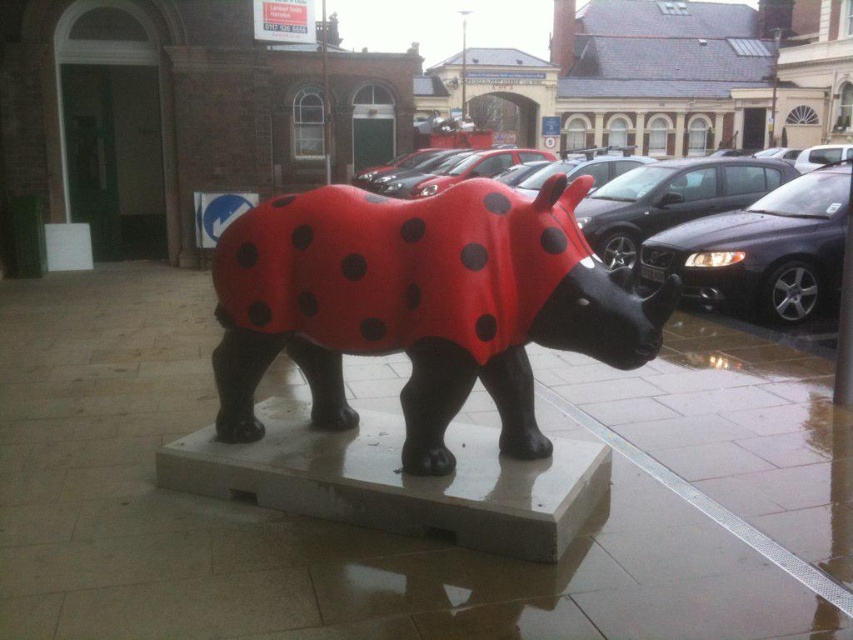
Question: Which point is closer to the camera?

Choices:
 (A) (695, 273)
 (B) (331, 294)

Answer: (B)

Question: Is matte red rhino at center wider than matte black car at right?

Choices:
 (A) no
 (B) yes

Answer: (A)

Question: Which point appears closest to the camera in this image?

Choices:
 (A) (724, 196)
 (B) (495, 376)

Answer: (B)

Question: Can you confirm if matte red rhino at center is positioned above matte black car at right?

Choices:
 (A) yes
 (B) no

Answer: (B)

Question: Can you confirm if matte red rhino at center is wider than shiny black car at center?

Choices:
 (A) no
 (B) yes

Answer: (A)

Question: Which object is closer to the camera taking this photo?

Choices:
 (A) shiny black car at center
 (B) matte red rhino at center
 (C) matte black car at right

Answer: (B)